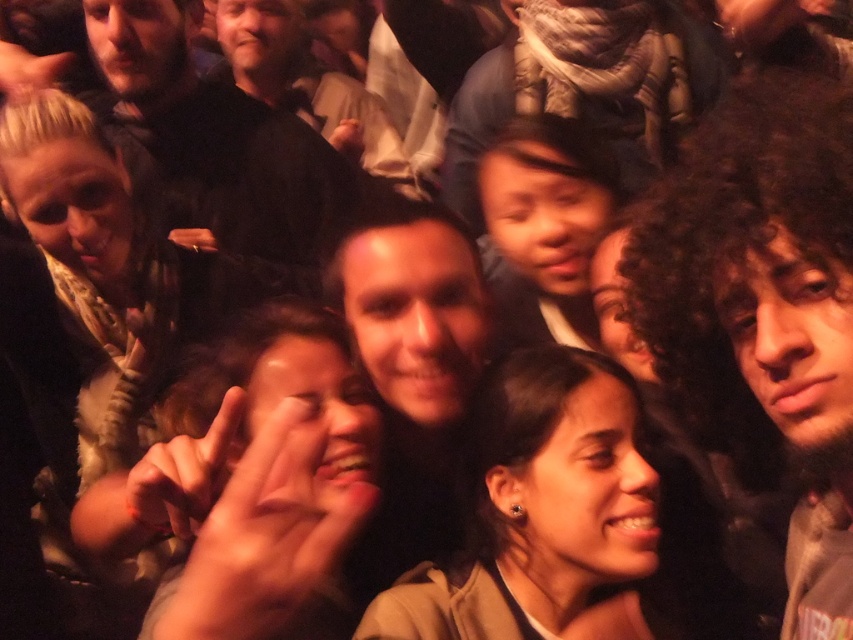
Is point (350, 499) positioned after point (47, 86)?

That is False.

Identify the location of skinny flesh-toned hand at center. (267, 536).

Can you confirm if smooth skin hand at upper left is positioned to the left of matte black ring at center?

Indeed, smooth skin hand at upper left is positioned on the left side of matte black ring at center.

Does smooth skin hand at upper left have a smaller size compared to matte black ring at center?

No.

You are a GUI agent. You are given a task and a screenshot of the screen. Output one action in this format:
    pyautogui.click(x=<x>, y=<y>)
    Task: Click on the smooth skin hand at upper left
    
    Given the screenshot: What is the action you would take?
    pyautogui.click(x=28, y=68)

Measure the distance from smooth skin hand at center to matte black ring at center.

smooth skin hand at center is 3.43 feet from matte black ring at center.

Does smooth skin hand at center appear on the left side of matte black ring at center?

In fact, smooth skin hand at center is to the right of matte black ring at center.

Does point (170, 464) lie in front of point (195, 236)?

Yes, it is.

At what (x,y) coordinates should I click in order to perform the action: click on smooth skin hand at center. Please return your answer as a coordinate pair (x, y). This screenshot has height=640, width=853. Looking at the image, I should click on (181, 476).